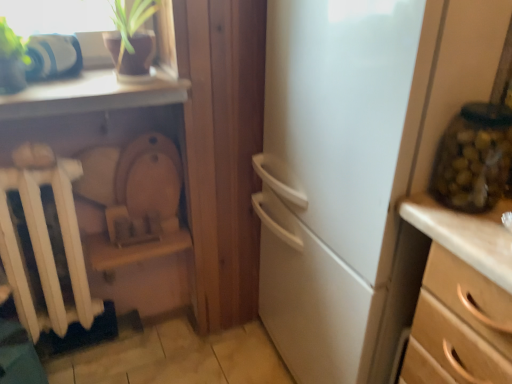
The image size is (512, 384). Describe the element at coordinates (45, 240) in the screenshot. I see `white matte radiator at left` at that location.

Where is `white matte radiator at left`? Image resolution: width=512 pixels, height=384 pixels. white matte radiator at left is located at coordinates (45, 240).

Between wooden chest of drawers at right and white matte radiator at left, which one has less height?

white matte radiator at left is shorter.

Considering the relative positions of wooden chest of drawers at right and white matte radiator at left in the image provided, is wooden chest of drawers at right to the left or to the right of white matte radiator at left?

In the image, wooden chest of drawers at right appears on the right side of white matte radiator at left.

Is wooden chest of drawers at right facing away from white matte radiator at left?

wooden chest of drawers at right is not turned away from white matte radiator at left.

Which object is further away from the camera, wooden chest of drawers at right or white matte radiator at left?

white matte radiator at left is behind.

From the picture: Is green glass jar at right smaller than wooden chest of drawers at right?

Indeed, green glass jar at right has a smaller size compared to wooden chest of drawers at right.

From the picture: From a real-world perspective, is green glass jar at right below wooden chest of drawers at right?

No, from a real-world perspective, green glass jar at right is not below wooden chest of drawers at right.

Is green glass jar at right oriented away from wooden chest of drawers at right?

No, green glass jar at right's orientation is not away from wooden chest of drawers at right.

What are the coordinates of `chest of drawers that is on the right side of green glass jar at right` in the screenshot? It's located at (461, 297).

Choose the correct answer: Is white matte radiator at left inside wooden chest of drawers at right or outside it?

white matte radiator at left lies outside wooden chest of drawers at right.

You are a GUI agent. You are given a task and a screenshot of the screen. Output one action in this format:
    pyautogui.click(x=<x>, y=<y>)
    Task: Click on the radiator above the wooden chest of drawers at right (from the image's perspective)
    
    Given the screenshot: What is the action you would take?
    pyautogui.click(x=45, y=240)

Which object is positioned more to the right, white matte radiator at left or wooden chest of drawers at right?

From the viewer's perspective, wooden chest of drawers at right appears more on the right side.

From a real-world perspective, is white matte radiator at left located beneath wooden chest of drawers at right?

No, from a real-world perspective, white matte radiator at left is not under wooden chest of drawers at right.

Identify the location of radiator that is on the left side of green glass jar at right. The image size is (512, 384). (45, 240).

Which is more to the right, green glass jar at right or white matte radiator at left?

green glass jar at right.

Between point (437, 157) and point (17, 179), which one is positioned behind?

The point (17, 179) is farther.

Is green glass jar at right thinner than white matte radiator at left?

Yes, green glass jar at right is thinner than white matte radiator at left.

Image resolution: width=512 pixels, height=384 pixels. I want to click on glass jar that appears on the right of white matte radiator at left, so click(474, 158).

Is white matte radiator at left outside of green glass jar at right?

Yes, white matte radiator at left is not within green glass jar at right.

Can you confirm if white matte radiator at left is bigger than green glass jar at right?

Correct, white matte radiator at left is larger in size than green glass jar at right.

Consider the image. Between white matte radiator at left and green glass jar at right, which one has less height?

green glass jar at right.

Can you see wooden chest of drawers at right touching green glass jar at right?

No, wooden chest of drawers at right is not next to green glass jar at right.

Who is smaller, wooden chest of drawers at right or green glass jar at right?

green glass jar at right.

From the image's perspective, is wooden chest of drawers at right below green glass jar at right?

Yes, from the image's perspective, wooden chest of drawers at right is beneath green glass jar at right.

I want to click on chest of drawers below the white matte radiator at left (from a real-world perspective), so pos(461,297).

At what (x,y) coordinates should I click in order to perform the action: click on glass jar above the wooden chest of drawers at right (from the image's perspective). Please return your answer as a coordinate pair (x, y). The height and width of the screenshot is (384, 512). Looking at the image, I should click on (474, 158).

When comparing their distances from wooden chest of drawers at right, does green glass jar at right or white matte radiator at left seem closer?

green glass jar at right lies closer to wooden chest of drawers at right than the other object.

Looking at the image, which one is located closer to green glass jar at right, white matte radiator at left or wooden chest of drawers at right?

wooden chest of drawers at right is closer to green glass jar at right.

From the image, which object appears to be nearer to green glass jar at right, wooden chest of drawers at right or white matte radiator at left?

wooden chest of drawers at right.

Looking at the image, which one is located closer to white matte radiator at left, green glass jar at right or wooden chest of drawers at right?

Based on the image, wooden chest of drawers at right appears to be nearer to white matte radiator at left.

Based on their spatial positions, is white matte radiator at left or green glass jar at right closer to wooden chest of drawers at right?

green glass jar at right is positioned closer to the anchor wooden chest of drawers at right.

Looking at this image, which object lies nearer to the anchor point white matte radiator at left, wooden chest of drawers at right or green glass jar at right?

wooden chest of drawers at right is positioned closer to the anchor white matte radiator at left.

Find the location of a particular element. glass jar between white matte radiator at left and wooden chest of drawers at right from left to right is located at coordinates (474, 158).